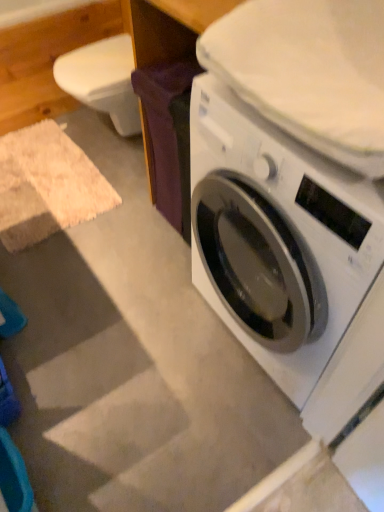
Question: From the image's perspective, is white glossy washing machine at lower right beneath purple fabric at center?

Choices:
 (A) no
 (B) yes

Answer: (B)

Question: Considering the relative sizes of white glossy washing machine at lower right and purple fabric at center in the image provided, is white glossy washing machine at lower right smaller than purple fabric at center?

Choices:
 (A) yes
 (B) no

Answer: (B)

Question: Does white glossy washing machine at lower right appear on the right side of purple fabric at center?

Choices:
 (A) yes
 (B) no

Answer: (A)

Question: Considering the relative sizes of white glossy washing machine at lower right and purple fabric at center in the image provided, is white glossy washing machine at lower right taller than purple fabric at center?

Choices:
 (A) yes
 (B) no

Answer: (A)

Question: Is the depth of white glossy washing machine at lower right less than that of purple fabric at center?

Choices:
 (A) yes
 (B) no

Answer: (A)

Question: Is the position of white glossy washing machine at lower right more distant than that of purple fabric at center?

Choices:
 (A) yes
 (B) no

Answer: (B)

Question: Is purple fabric at center shorter than white glossy washing machine at lower right?

Choices:
 (A) no
 (B) yes

Answer: (B)

Question: Is purple fabric at center closer to camera compared to white glossy washing machine at lower right?

Choices:
 (A) yes
 (B) no

Answer: (B)

Question: From a real-world perspective, is purple fabric at center positioned under white glossy washing machine at lower right based on gravity?

Choices:
 (A) no
 (B) yes

Answer: (B)

Question: Can you confirm if purple fabric at center is smaller than white glossy washing machine at lower right?

Choices:
 (A) no
 (B) yes

Answer: (B)

Question: Does purple fabric at center appear on the left side of white glossy washing machine at lower right?

Choices:
 (A) no
 (B) yes

Answer: (B)

Question: Considering the relative sizes of purple fabric at center and white glossy washing machine at lower right in the image provided, is purple fabric at center bigger than white glossy washing machine at lower right?

Choices:
 (A) no
 (B) yes

Answer: (A)

Question: From their relative heights in the image, would you say purple fabric at center is taller or shorter than white glossy washing machine at lower right?

Choices:
 (A) short
 (B) tall

Answer: (A)